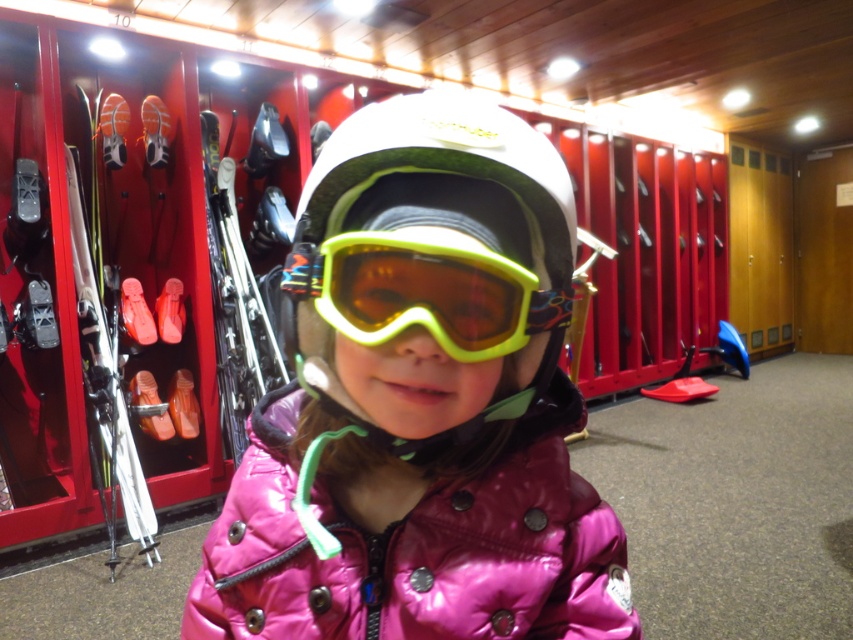
You are a ski instructor helping a child get ready. The child is wearing a pink shiny jacket at center and a white matte helmet at center. You need to check if the helmet is properly secured. Since the helmet must be snug against the jacket, can you confirm if there is enough space between them for safety?

The pink shiny jacket at center and the white matte helmet at center are 4.48 inches apart from each other. This distance indicates that there is too much space between them, so the helmet is not snug and needs adjustment to ensure proper safety.

You are helping a parent find their child in a ski locker room. The parent mentions their child is wearing a pink shiny jacket at center and there are shiny metallic skis at left. Based on the description, which object is smaller?

The pink shiny jacket at center is smaller than the shiny metallic skis at left.